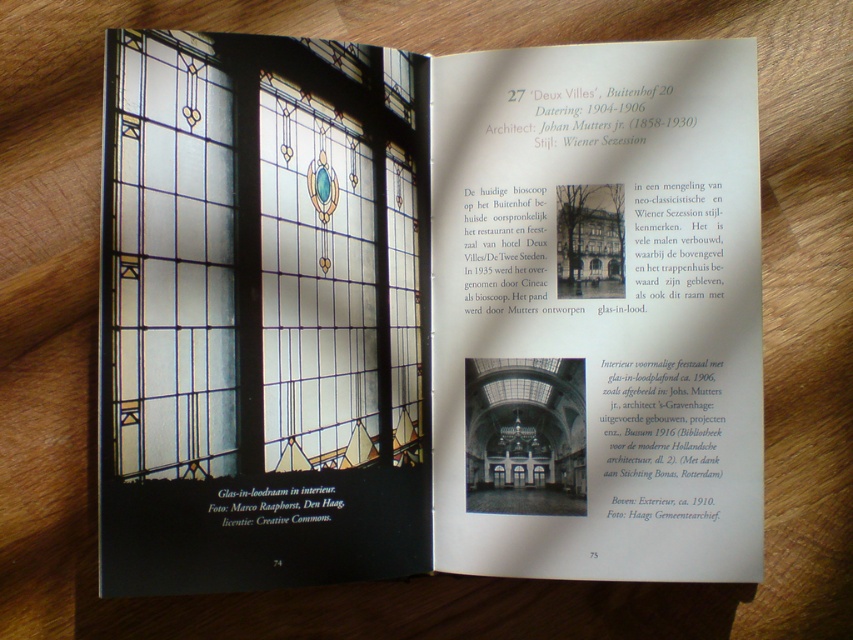
Question: Is stained glass window at upper left wider than clear stained glass at center?

Choices:
 (A) yes
 (B) no

Answer: (A)

Question: Which point is farther to the camera?

Choices:
 (A) (111, 412)
 (B) (374, 500)

Answer: (B)

Question: Does stained glass window at upper left have a smaller size compared to clear stained glass at center?

Choices:
 (A) yes
 (B) no

Answer: (B)

Question: Can you confirm if stained glass window at upper left is positioned above clear stained glass at center?

Choices:
 (A) yes
 (B) no

Answer: (B)